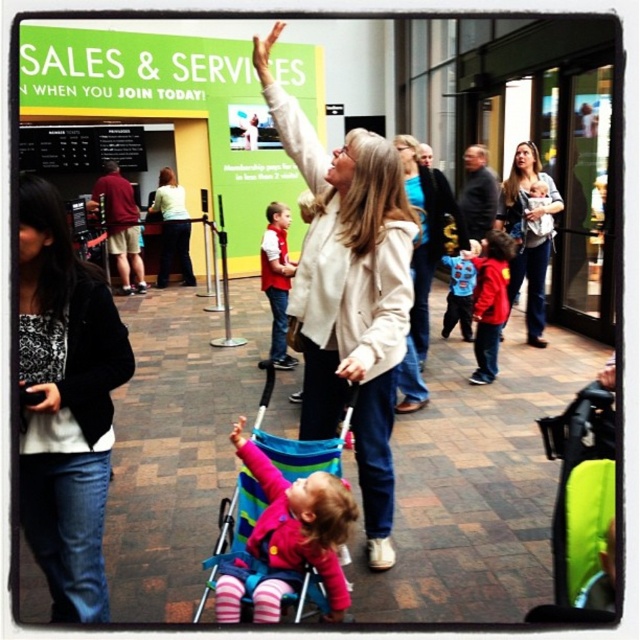
Can you confirm if black textured jacket at left is shorter than neon green fabric folding chair at center?

No.

Is point (84, 340) positioned behind point (604, 566)?

Yes, point (84, 340) is behind point (604, 566).

The width and height of the screenshot is (640, 640). Find the location of `black textured jacket at left`. black textured jacket at left is located at coordinates (65, 403).

Based on the photo, does white fleece jacket at center have a greater width compared to multicolored fabric stroller at center?

Correct, the width of white fleece jacket at center exceeds that of multicolored fabric stroller at center.

In the scene shown: Is white fleece jacket at center to the right of multicolored fabric stroller at center from the viewer's perspective?

Correct, you'll find white fleece jacket at center to the right of multicolored fabric stroller at center.

At what (x,y) coordinates should I click in order to perform the action: click on white fleece jacket at center. Please return your answer as a coordinate pair (x, y). The width and height of the screenshot is (640, 640). Looking at the image, I should click on (349, 292).

Does point (577, 611) come farther from viewer compared to point (538, 192)?

No, (577, 611) is closer to viewer.

Can you confirm if neon green fabric folding chair at center is bigger than matte white jacket at center?

No, neon green fabric folding chair at center is not bigger than matte white jacket at center.

The width and height of the screenshot is (640, 640). Identify the location of neon green fabric folding chair at center. click(580, 508).